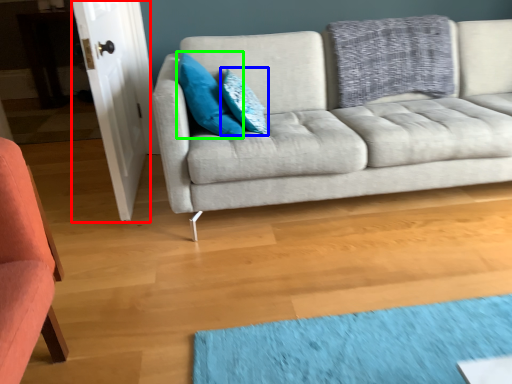
Question: Which object is positioned closest to door (highlighted by a red box)? Select from pillow (highlighted by a blue box) and pillow (highlighted by a green box).

Choices:
 (A) pillow
 (B) pillow

Answer: (B)